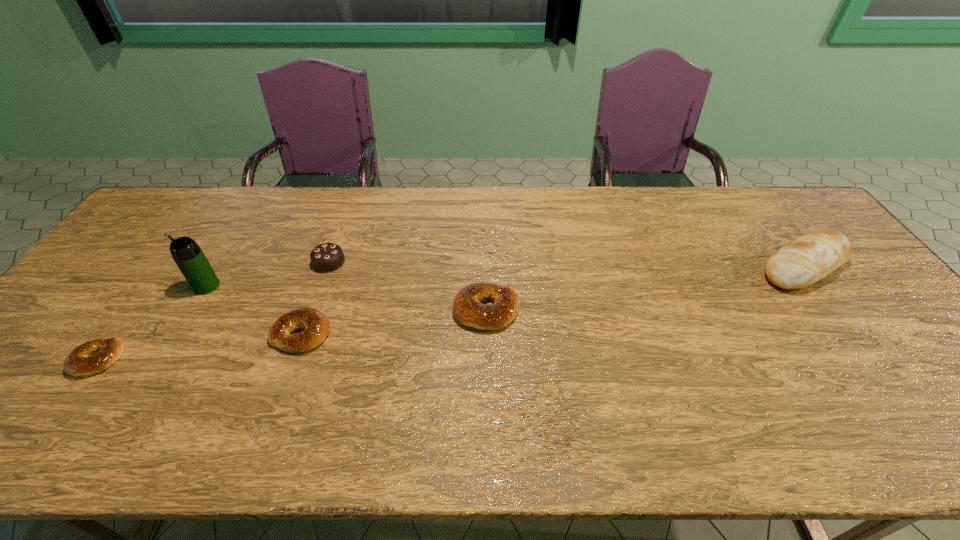
You are a GUI agent. You are given a task and a screenshot of the screen. Output one action in this format:
    pyautogui.click(x=<x>, y=<y>)
    Task: Click on the free space that satisfies the following two spatial constraints: 1. on the back side of the shortest object; 2. on the left side of the second tallest object
    The height and width of the screenshot is (540, 960).
    Given the screenshot: What is the action you would take?
    pyautogui.click(x=165, y=267)

The height and width of the screenshot is (540, 960). I want to click on free region that satisfies the following two spatial constraints: 1. on the back side of the second shortest object; 2. on the left side of the fourth shortest object, so click(327, 262).

The image size is (960, 540). I want to click on vacant space that satisfies the following two spatial constraints: 1. on the back side of the tallest bagel; 2. on the left side of the shortest object, so click(x=132, y=310).

This screenshot has width=960, height=540. Identify the location of vacant area that satisfies the following two spatial constraints: 1. on the back side of the leftmost bagel; 2. on the right side of the fifth object from left to right. (132, 310).

Identify the location of free spot that satisfies the following two spatial constraints: 1. on the front side of the chocolate cake; 2. from the spout of the second object from left to right. The image size is (960, 540). (321, 286).